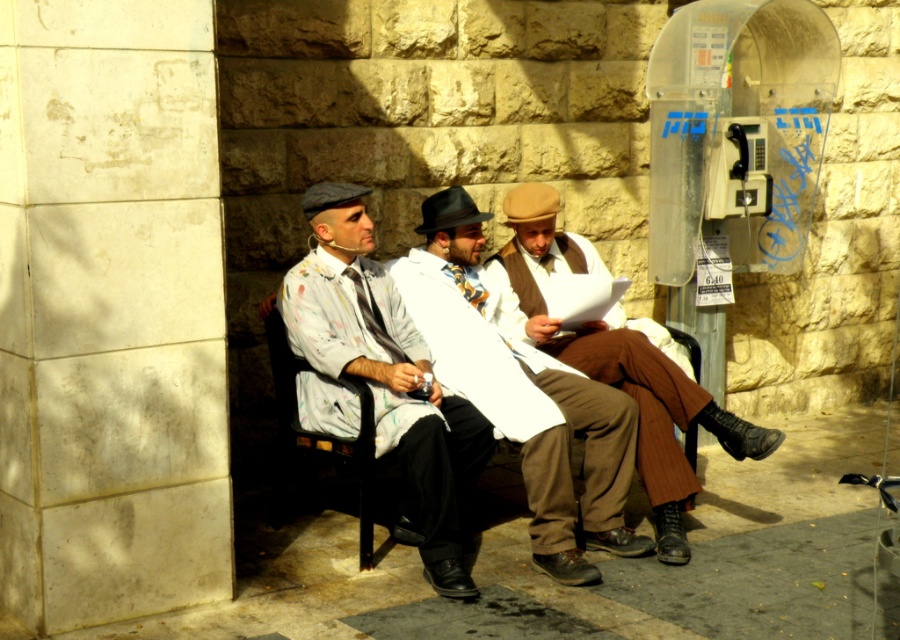
You are standing in front of the black bench where the three men are sitting. You want to walk to the point that is closer to you. Which point should you walk to, point (x=660, y=396) or point (x=729, y=134)?

You should walk to point (x=660, y=396) because it is closer to you than point (x=729, y=134).

You are a delivery person who needs to place a package on the bench where the brown woolen vest at center and the metallic gray payphone at upper right are located. Can you tell me where exactly to place the package so it won

The brown woolen vest at center is below the metallic gray payphone at upper right, so the package should be placed on the bench below the payphone to ensure it is near the vest.

You are a person standing at the entrance of the park. You see a white cotton coat at center and a metallic gray payphone at upper right. Which object is closer to the left side of the park?

The white cotton coat at center is closer to the left side of the park because it is positioned to the left of the metallic gray payphone at upper right.